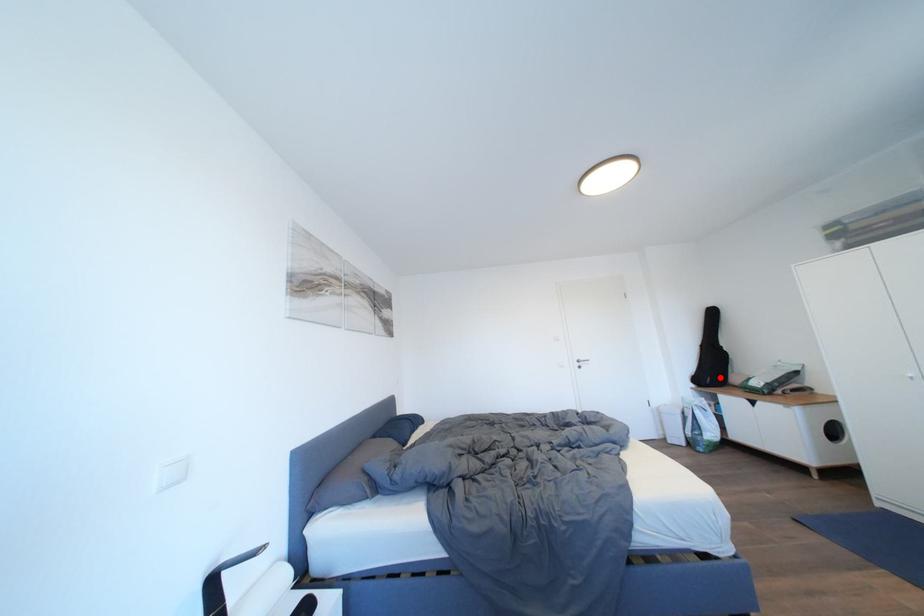
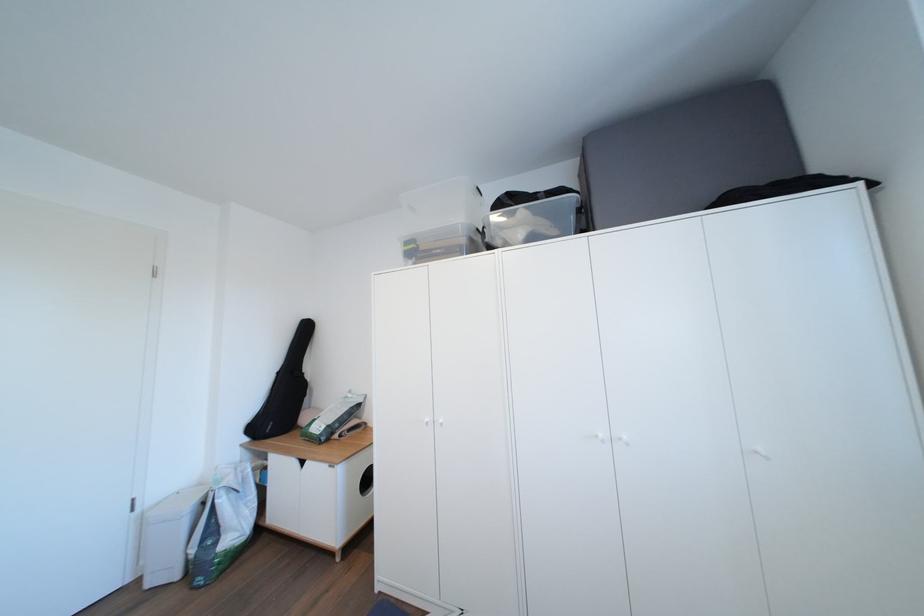
The point at the highlighted location is marked in the first image. Where is the corresponding point in the second image?

(289, 416)